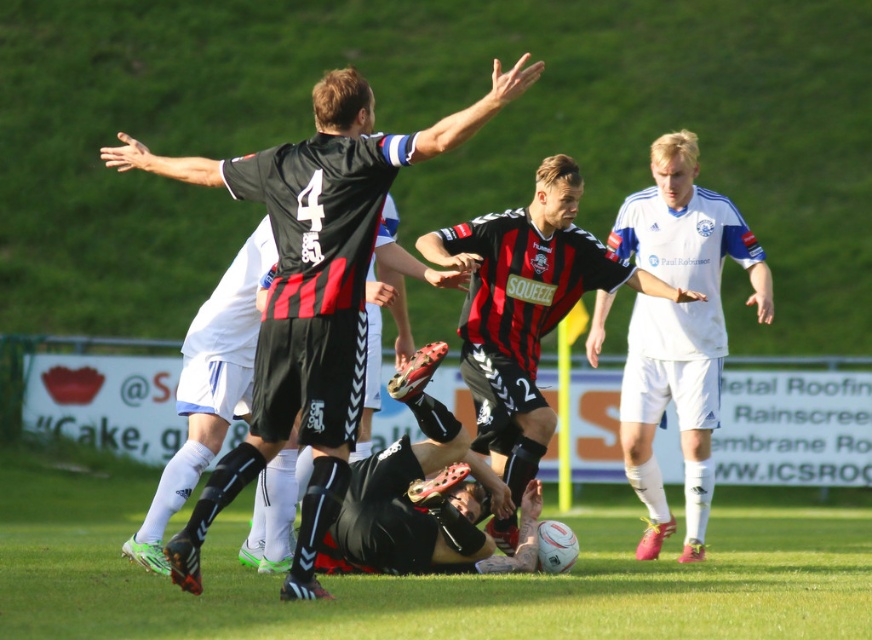
Question: Does white smooth soccer player at right appear over black jersey at center?

Choices:
 (A) no
 (B) yes

Answer: (B)

Question: Which point is closer to the camera?

Choices:
 (A) black jersey at center
 (B) white smooth soccer player at right
 (C) black matte jersey at center

Answer: (C)

Question: Is white smooth soccer player at right above black jersey at center?

Choices:
 (A) no
 (B) yes

Answer: (B)

Question: Which of the following is the closest to the observer?

Choices:
 (A) (312, 424)
 (B) (632, 349)
 (C) (503, 280)

Answer: (A)

Question: Observing the image, what is the correct spatial positioning of black matte jersey at center in reference to white smooth soccer player at right?

Choices:
 (A) right
 (B) left

Answer: (B)

Question: Among these points, which one is nearest to the camera?

Choices:
 (A) (687, 257)
 (B) (494, 106)
 (C) (426, 256)

Answer: (B)